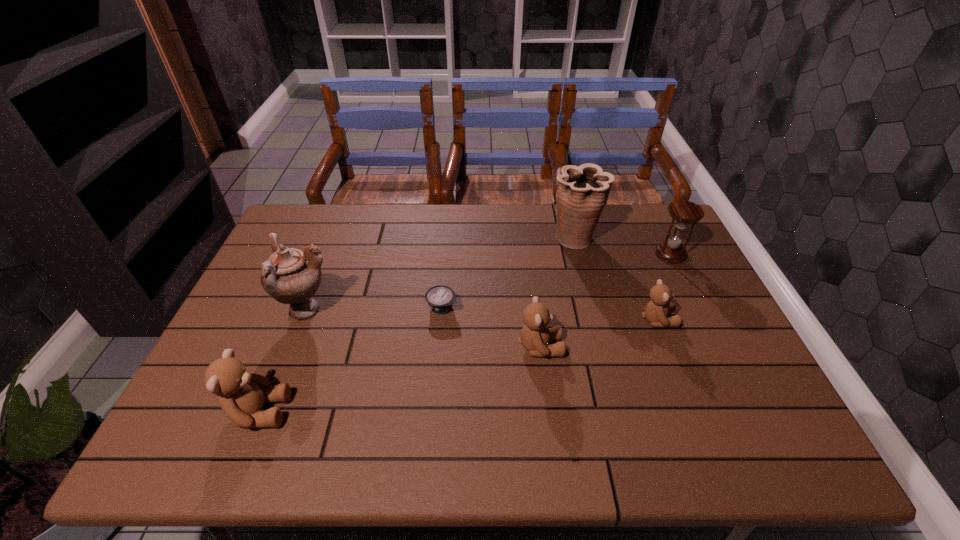
Where is `vacant space that is in between the hourglass and the fifth object from right to left`? The width and height of the screenshot is (960, 540). vacant space that is in between the hourglass and the fifth object from right to left is located at coordinates (556, 281).

Where is `free area in between the fifth object from right to left and the third object from right to left`? The image size is (960, 540). free area in between the fifth object from right to left and the third object from right to left is located at coordinates (509, 273).

You are a GUI agent. You are given a task and a screenshot of the screen. Output one action in this format:
    pyautogui.click(x=<x>, y=<y>)
    Task: Click on the vacant area between the left urn and the rightmost teddy bear
    This screenshot has height=540, width=960.
    Given the screenshot: What is the action you would take?
    pyautogui.click(x=483, y=315)

Choose which object is the sixth nearest neighbor to the nearer urn. Please provide its 2D coordinates. Your answer should be formatted as a tuple, i.e. [(x, y)], where the tuple contains the x and y coordinates of a point satisfying the conditions above.

[(683, 212)]

Locate which object is the second closest to the second teddy bear from left to right. Please provide its 2D coordinates. Your answer should be formatted as a tuple, i.e. [(x, y)], where the tuple contains the x and y coordinates of a point satisfying the conditions above.

[(655, 311)]

Choose which teddy bear is the third nearest neighbor to the left urn. Please provide its 2D coordinates. Your answer should be formatted as a tuple, i.e. [(x, y)], where the tuple contains the x and y coordinates of a point satisfying the conditions above.

[(655, 311)]

Identify which teddy bear is located as the third nearest to the shortest object. Please provide its 2D coordinates. Your answer should be formatted as a tuple, i.e. [(x, y)], where the tuple contains the x and y coordinates of a point satisfying the conditions above.

[(655, 311)]

You are a GUI agent. You are given a task and a screenshot of the screen. Output one action in this format:
    pyautogui.click(x=<x>, y=<y>)
    Task: Click on the vacant region that satisfies the following two spatial constraints: 1. on the front side of the hourglass; 2. on the face of the nearest object
    Image resolution: width=960 pixels, height=540 pixels.
    Given the screenshot: What is the action you would take?
    (748, 411)